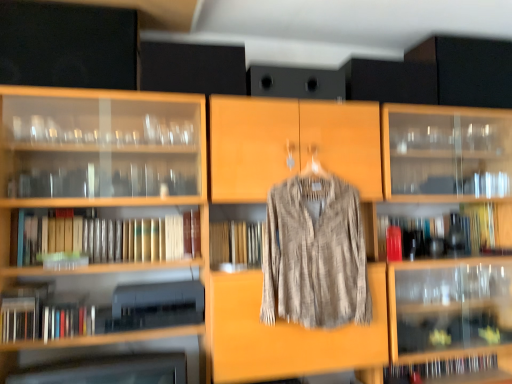
Question: From the image's perspective, is textured beige shirt at center below wooden book at center, the second book from the left?

Choices:
 (A) no
 (B) yes

Answer: (A)

Question: From the image's perspective, does textured beige shirt at center appear higher than wooden book at center, placed as the second book when sorted from bottom to top?

Choices:
 (A) no
 (B) yes

Answer: (B)

Question: Does textured beige shirt at center have a greater height compared to wooden book at center, which ranks as the third book in right-to-left order?

Choices:
 (A) no
 (B) yes

Answer: (B)

Question: Does textured beige shirt at center have a greater width compared to wooden book at center, placed as the second book when sorted from bottom to top?

Choices:
 (A) yes
 (B) no

Answer: (B)

Question: From a real-world perspective, is textured beige shirt at center on wooden book at center, placed as the second book when sorted from bottom to top?

Choices:
 (A) yes
 (B) no

Answer: (A)

Question: From the image's perspective, is wooden book at center, placed as the second book when sorted from bottom to top, located above or below white paper book at center, the first book from the left?

Choices:
 (A) above
 (B) below

Answer: (B)

Question: Considering the relative positions of wooden book at center, placed as the second book when sorted from bottom to top, and white paper book at center, which is the 3th book in bottom-to-top order, in the image provided, is wooden book at center, placed as the second book when sorted from bottom to top, to the left or to the right of white paper book at center, which is the 3th book in bottom-to-top order,?

Choices:
 (A) right
 (B) left

Answer: (A)

Question: Is wooden book at center, placed as the second book when sorted from bottom to top, wider or thinner than white paper book at center, arranged as the 4th book when viewed from the right?

Choices:
 (A) thin
 (B) wide

Answer: (B)

Question: Is wooden book at center, the second book from the left, inside or outside of white paper book at center, which is the 3th book in bottom-to-top order?

Choices:
 (A) outside
 (B) inside

Answer: (A)

Question: Is textured beige shirt at center taller or shorter than wooden book at center, placed as the second book when sorted from bottom to top?

Choices:
 (A) tall
 (B) short

Answer: (A)

Question: Based on their sizes in the image, would you say textured beige shirt at center is bigger or smaller than wooden book at center, placed as the second book when sorted from bottom to top?

Choices:
 (A) big
 (B) small

Answer: (A)

Question: From a real-world perspective, relative to wooden book at center, the second book from the left, is textured beige shirt at center vertically above or below?

Choices:
 (A) above
 (B) below

Answer: (A)

Question: Is textured beige shirt at center spatially inside wooden book at center, the second book from the left, or outside of it?

Choices:
 (A) outside
 (B) inside

Answer: (A)

Question: Is yellow paperback book at right, the fourth book in the left-to-right sequence, taller or shorter than textured beige shirt at center?

Choices:
 (A) tall
 (B) short

Answer: (B)

Question: In the image, is yellow paperback book at right, the fourth book in the left-to-right sequence, on the left side or the right side of textured beige shirt at center?

Choices:
 (A) right
 (B) left

Answer: (A)